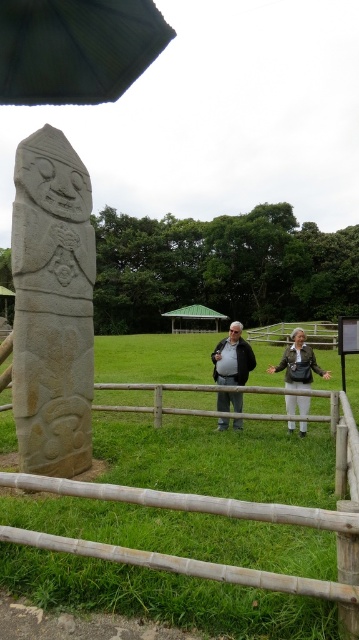
Question: Which object is closer to the camera taking this photo?

Choices:
 (A) white stone carving at left
 (B) dark gray stone statue at center
 (C) green fabric umbrella at upper left

Answer: (C)

Question: Is dark gray stone statue at center smaller than wooden at center?

Choices:
 (A) yes
 (B) no

Answer: (A)

Question: Is white stone carving at left to the right of green grass at center from the viewer's perspective?

Choices:
 (A) no
 (B) yes

Answer: (A)

Question: Which of the following is the closest to the observer?

Choices:
 (A) tap(11, 474)
 (B) tap(264, 340)
 (C) tap(217, 358)

Answer: (A)

Question: Which of the following is the closest to the observer?

Choices:
 (A) (302, 428)
 (B) (229, 344)
 (C) (305, 328)
 (D) (122, 13)

Answer: (D)

Question: Can you confirm if green grass at center is positioned to the left of green fabric umbrella at upper left?

Choices:
 (A) no
 (B) yes

Answer: (A)